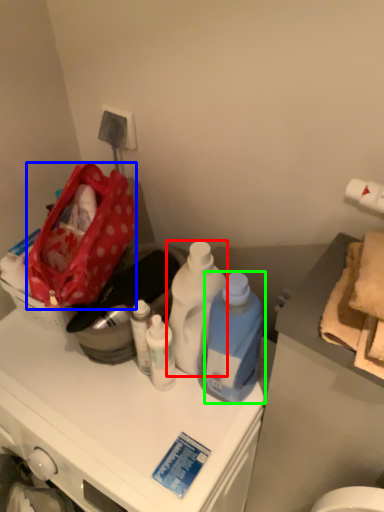
Question: Which object is the farthest from bottle (highlighted by a red box)? Choose among these: handbag (highlighted by a blue box) or bottle (highlighted by a green box).

Choices:
 (A) handbag
 (B) bottle

Answer: (A)